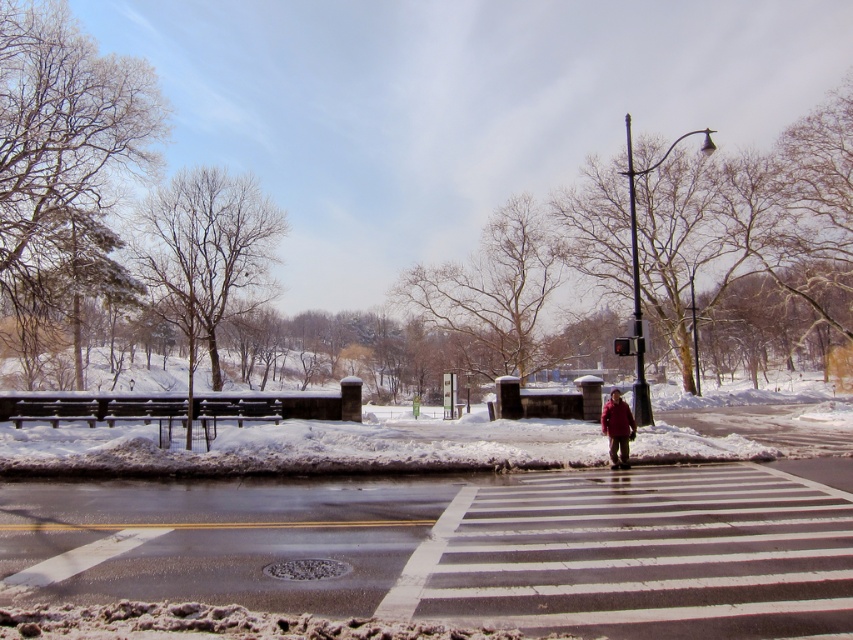
You are a pedestrian approaching the white painted crosswalk at center and the red wool coat at crosswalk. Which object will you encounter first as you walk towards them?

The white painted crosswalk at center is closer to the viewer than the red wool coat at crosswalk, so you will encounter the white painted crosswalk at center first.

You are a delivery person trying to navigate through the crosswalk. You need to pass between the red wool coat at crosswalk and the red glass traffic light at center. Which object do you need to go around more carefully?

The red wool coat at crosswalk might be wider than the red glass traffic light at center, so you should go around it more carefully to avoid collision.